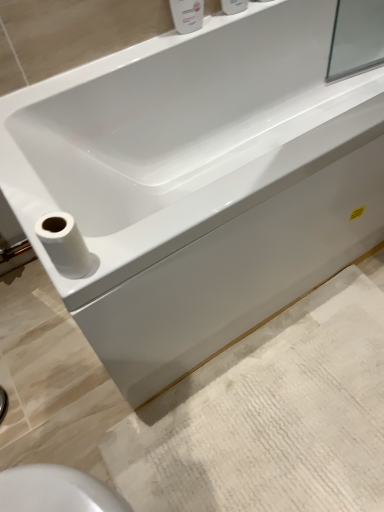
Question: Does white glossy bottle at upper center, the 1th toiletry viewed from the right, lie behind white matte toilet paper at lower left?

Choices:
 (A) no
 (B) yes

Answer: (B)

Question: From a real-world perspective, does white glossy bottle at upper center, the 1th toiletry viewed from the right, stand above white matte toilet paper at lower left?

Choices:
 (A) no
 (B) yes

Answer: (B)

Question: Does white glossy bottle at upper center, the 1th toiletry viewed from the right, have a lesser width compared to white matte toilet paper at lower left?

Choices:
 (A) no
 (B) yes

Answer: (B)

Question: From a real-world perspective, is white glossy bottle at upper center, the 1th toiletry viewed from the right, located beneath white matte toilet paper at lower left?

Choices:
 (A) yes
 (B) no

Answer: (B)

Question: Considering the relative sizes of white glossy bottle at upper center, which appears as the 2th toiletry when viewed from the left, and white matte toilet paper at lower left in the image provided, is white glossy bottle at upper center, which appears as the 2th toiletry when viewed from the left, taller than white matte toilet paper at lower left?

Choices:
 (A) no
 (B) yes

Answer: (B)

Question: Would you say white textured bath mat at lower right is to the left or to the right of white matte toilet paper at lower left in the picture?

Choices:
 (A) left
 (B) right

Answer: (B)

Question: Considering the positions of white textured bath mat at lower right and white matte toilet paper at lower left in the image, is white textured bath mat at lower right wider or thinner than white matte toilet paper at lower left?

Choices:
 (A) wide
 (B) thin

Answer: (A)

Question: From a real-world perspective, relative to white matte toilet paper at lower left, is white textured bath mat at lower right vertically above or below?

Choices:
 (A) above
 (B) below

Answer: (B)

Question: From the image's perspective, is white textured bath mat at lower right above or below white matte toilet paper at lower left?

Choices:
 (A) below
 (B) above

Answer: (A)

Question: Is white textured bath mat at lower right taller or shorter than white glossy soap dispenser at upper center, which is the 2th toiletry from right to left?

Choices:
 (A) tall
 (B) short

Answer: (B)

Question: Would you say white textured bath mat at lower right is inside or outside white glossy soap dispenser at upper center, the first toiletry when ordered from left to right?

Choices:
 (A) inside
 (B) outside

Answer: (B)

Question: Is point (246, 366) closer or farther from the camera than point (192, 13)?

Choices:
 (A) closer
 (B) farther

Answer: (A)

Question: From the image's perspective, relative to white glossy soap dispenser at upper center, the first toiletry when ordered from left to right, is white textured bath mat at lower right above or below?

Choices:
 (A) above
 (B) below

Answer: (B)

Question: Considering the positions of white glossy soap dispenser at upper center, the first toiletry when ordered from left to right, and white textured bath mat at lower right in the image, is white glossy soap dispenser at upper center, the first toiletry when ordered from left to right, taller or shorter than white textured bath mat at lower right?

Choices:
 (A) short
 (B) tall

Answer: (B)

Question: Looking at the image, does white glossy soap dispenser at upper center, the first toiletry when ordered from left to right, seem bigger or smaller compared to white textured bath mat at lower right?

Choices:
 (A) big
 (B) small

Answer: (B)